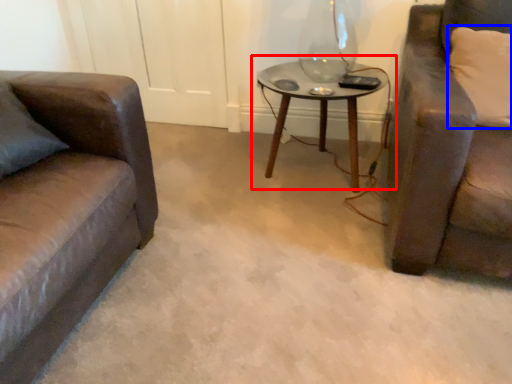
Question: Which of the following is the closest to the observer, table (highlighted by a red box) or pillow (highlighted by a blue box)?

Choices:
 (A) table
 (B) pillow

Answer: (B)